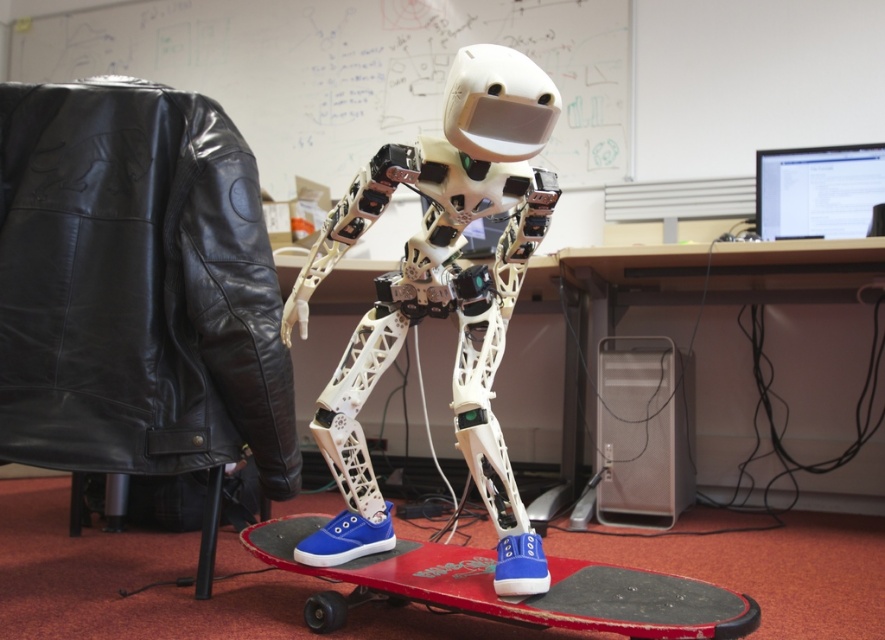
Describe the element at coordinates (137, 292) in the screenshot. I see `black leather jacket at left` at that location.

Between point (244, 266) and point (389, 525), which one is positioned behind?

The point (389, 525) is behind.

Does point (248, 401) lie in front of point (466, 392)?

No, (248, 401) is behind (466, 392).

At what (x,y) coordinates should I click in order to perform the action: click on black leather jacket at left. Please return your answer as a coordinate pair (x, y). The height and width of the screenshot is (640, 885). Looking at the image, I should click on (137, 292).

Is black leather jacket at left bigger than red plastic skateboard at center?

Correct, black leather jacket at left is larger in size than red plastic skateboard at center.

Locate an element on the screen. black leather jacket at left is located at coordinates (137, 292).

The image size is (885, 640). Describe the element at coordinates (137, 292) in the screenshot. I see `black leather jacket at left` at that location.

Identify the location of black leather jacket at left. The height and width of the screenshot is (640, 885). [x=137, y=292].

Who is shorter, white matte robot at center or red plastic skateboard at center?

Standing shorter between the two is red plastic skateboard at center.

Describe the element at coordinates (440, 298) in the screenshot. This screenshot has height=640, width=885. I see `white matte robot at center` at that location.

The image size is (885, 640). Find the location of `white matte robot at center`. white matte robot at center is located at coordinates (440, 298).